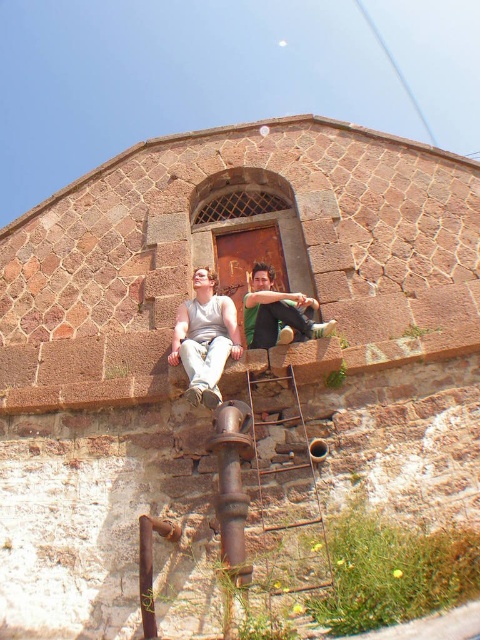
Question: Considering the relative positions of gray matte tank top at center and rusty metal pipe at lower center in the image provided, where is gray matte tank top at center located with respect to rusty metal pipe at lower center?

Choices:
 (A) left
 (B) right

Answer: (B)

Question: Which point is closer to the camera?

Choices:
 (A) (275, 518)
 (B) (219, 481)
 (C) (300, 314)

Answer: (B)

Question: Among these points, which one is nearest to the camera?

Choices:
 (A) (252, 291)
 (B) (148, 589)

Answer: (B)

Question: Is rusty metal ladder at center thinner than matte gray t-shirt at center?

Choices:
 (A) no
 (B) yes

Answer: (B)

Question: In this image, where is gray matte tank top at center located relative to rusty metal pipe at lower center?

Choices:
 (A) above
 (B) below

Answer: (A)

Question: Which point is closer to the camera?

Choices:
 (A) (219, 320)
 (B) (143, 630)
 (C) (227, 476)
 (D) (298, 577)

Answer: (B)